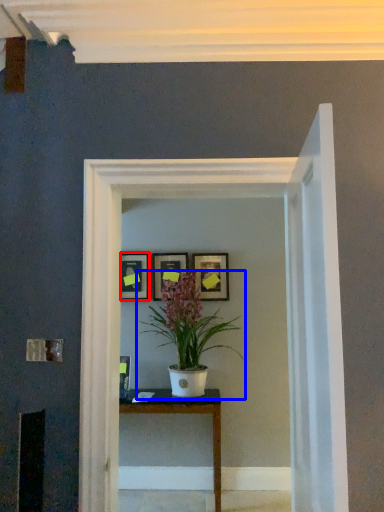
Question: Among these objects, which one is farthest to the camera, picture frame (highlighted by a red box) or houseplant (highlighted by a blue box)?

Choices:
 (A) picture frame
 (B) houseplant

Answer: (A)